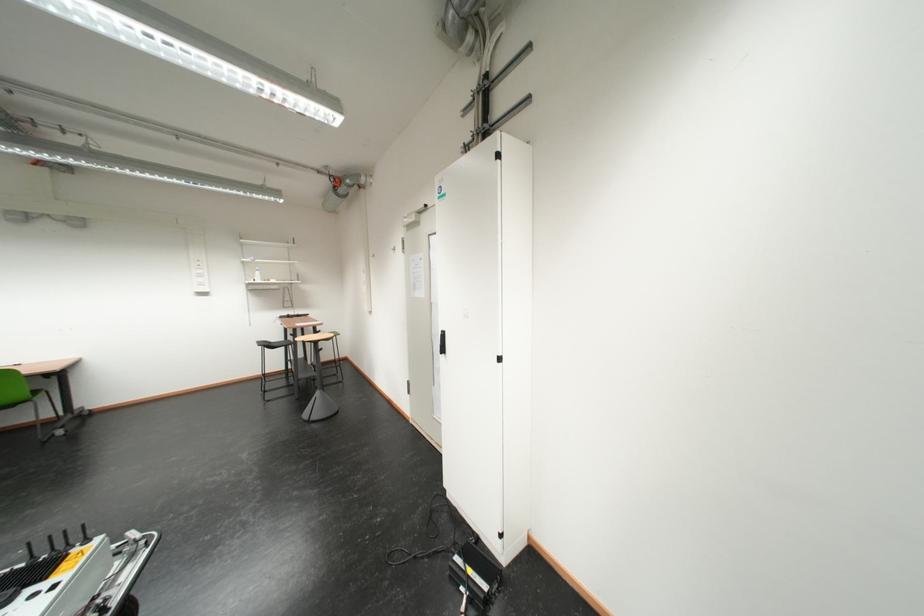
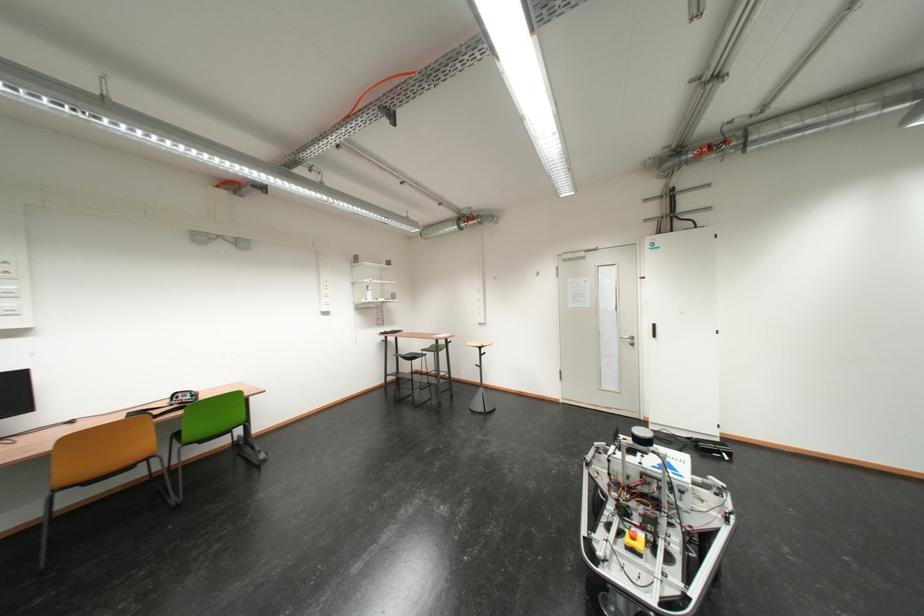
Question: Which direction would the cameraman need to move to produce the second image? Reply with the corresponding letter.

Choices:
 (A) Left
 (B) Right
 (C) Forward
 (D) Backward

Answer: (A)